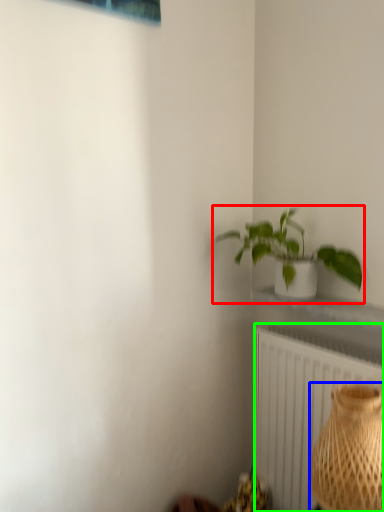
Question: Estimate the real-world distances between objects in this image. Which object is closer to houseplant (highlighted by a red box), vase (highlighted by a blue box) or radiator (highlighted by a green box)?

Choices:
 (A) vase
 (B) radiator

Answer: (B)